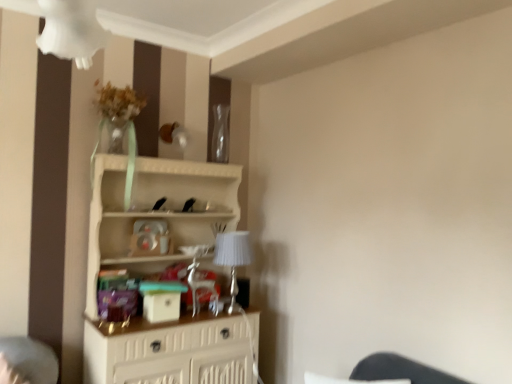
Question: From a real-world perspective, is silver metallic table lamp at center physically below white wood shelf at center?

Choices:
 (A) yes
 (B) no

Answer: (B)

Question: Considering the relative positions of silver metallic table lamp at center and white wood shelf at center in the image provided, is silver metallic table lamp at center to the right of white wood shelf at center from the viewer's perspective?

Choices:
 (A) no
 (B) yes

Answer: (B)

Question: Is silver metallic table lamp at center looking in the opposite direction of white wood shelf at center?

Choices:
 (A) no
 (B) yes

Answer: (B)

Question: Is silver metallic table lamp at center not within white wood shelf at center?

Choices:
 (A) yes
 (B) no

Answer: (B)

Question: Are silver metallic table lamp at center and white wood shelf at center far apart?

Choices:
 (A) no
 (B) yes

Answer: (A)

Question: Does silver metallic table lamp at center have a greater height compared to white wood shelf at center?

Choices:
 (A) yes
 (B) no

Answer: (B)

Question: Are transparent glass vase at upper center and silver metallic table lamp at center located far from each other?

Choices:
 (A) no
 (B) yes

Answer: (A)

Question: Is transparent glass vase at upper center turned away from silver metallic table lamp at center?

Choices:
 (A) yes
 (B) no

Answer: (B)

Question: From the image's perspective, does transparent glass vase at upper center appear higher than silver metallic table lamp at center?

Choices:
 (A) yes
 (B) no

Answer: (A)

Question: Is transparent glass vase at upper center at the right side of silver metallic table lamp at center?

Choices:
 (A) yes
 (B) no

Answer: (B)

Question: Does transparent glass vase at upper center have a greater width compared to silver metallic table lamp at center?

Choices:
 (A) no
 (B) yes

Answer: (A)

Question: Is silver metallic table lamp at center surrounded by transparent glass vase at upper center?

Choices:
 (A) yes
 (B) no

Answer: (B)

Question: Is white wood shelf at center looking in the opposite direction of transparent glass vase at upper center?

Choices:
 (A) no
 (B) yes

Answer: (A)